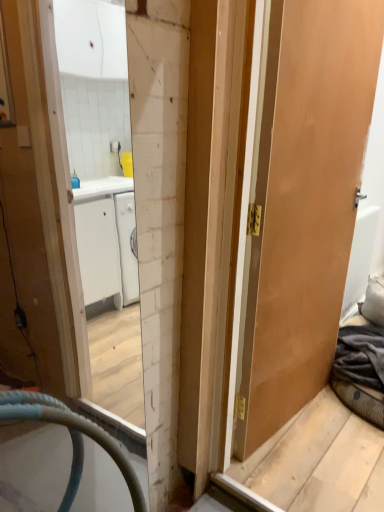
Question: Relative to matte wooden door at right, is white textured radiator at right in front or behind?

Choices:
 (A) behind
 (B) front

Answer: (A)

Question: Is white textured radiator at right to the left or to the right of matte wooden door at right in the image?

Choices:
 (A) right
 (B) left

Answer: (A)

Question: From a real-world perspective, relative to matte wooden door at right, is white textured radiator at right vertically above or below?

Choices:
 (A) above
 (B) below

Answer: (B)

Question: Considering the positions of point (347, 130) and point (352, 286), is point (347, 130) closer or farther from the camera than point (352, 286)?

Choices:
 (A) closer
 (B) farther

Answer: (A)

Question: Based on their positions, is matte wooden door at right located to the left or right of white textured radiator at right?

Choices:
 (A) left
 (B) right

Answer: (A)

Question: From the image's perspective, relative to white textured radiator at right, is matte wooden door at right above or below?

Choices:
 (A) below
 (B) above

Answer: (B)

Question: Considering the positions of matte wooden door at right and white textured radiator at right in the image, is matte wooden door at right taller or shorter than white textured radiator at right?

Choices:
 (A) short
 (B) tall

Answer: (B)